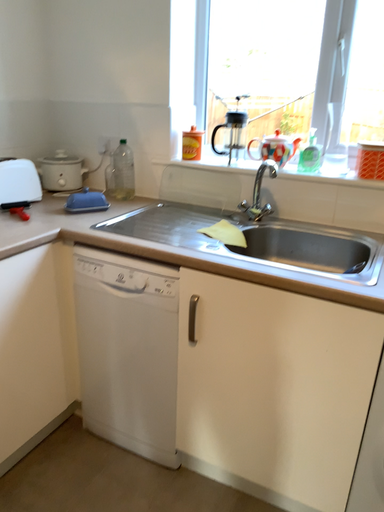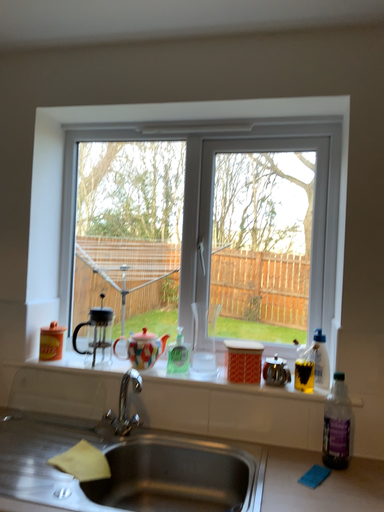
Question: Which way did the camera rotate in the video?

Choices:
 (A) rotated upward
 (B) rotated downward

Answer: (A)